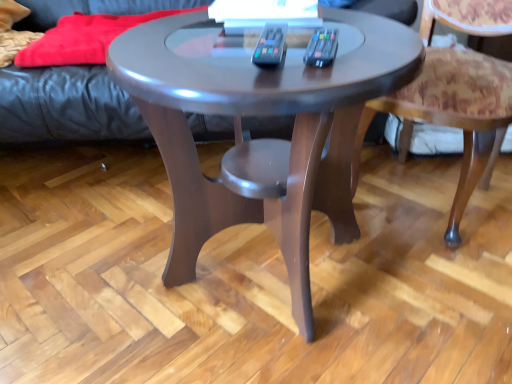
Question: Considering the positions of patterned fabric chair at lower right and leather couch at upper left in the image, is patterned fabric chair at lower right taller or shorter than leather couch at upper left?

Choices:
 (A) short
 (B) tall

Answer: (B)

Question: Is point (508, 96) positioned closer to the camera than point (75, 114)?

Choices:
 (A) farther
 (B) closer

Answer: (B)

Question: Which object is positioned farthest from the patterned fabric chair at lower right?

Choices:
 (A) glossy wood coffee table at center
 (B) leather couch at upper left

Answer: (B)

Question: Based on their relative distances, which object is farther from the glossy wood coffee table at center?

Choices:
 (A) patterned fabric chair at lower right
 (B) leather couch at upper left

Answer: (B)